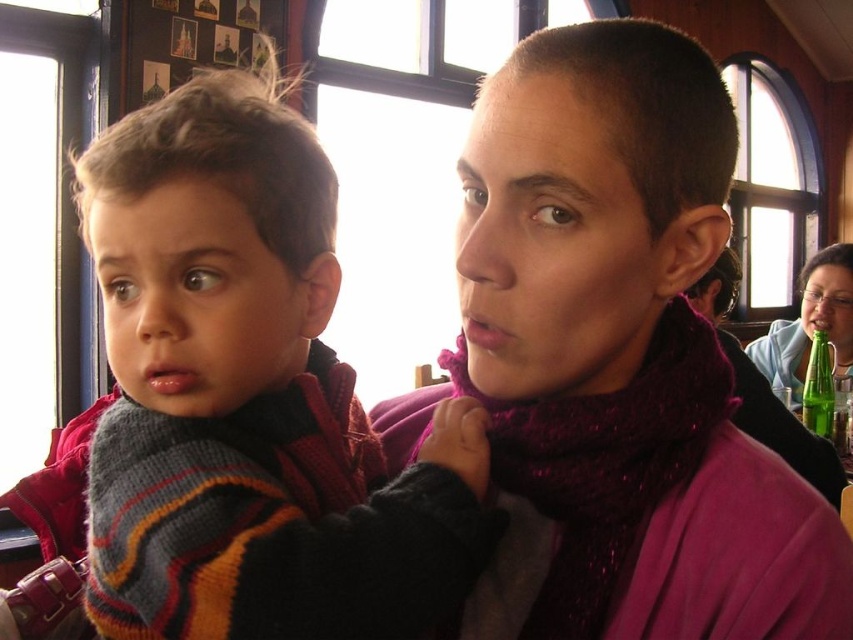
Question: Can you confirm if maroon knitted scarf at center is bigger than green glass bottle at upper right?

Choices:
 (A) no
 (B) yes

Answer: (A)

Question: Estimate the real-world distances between objects in this image. Which object is closer to the woolen maroon scarf at center?

Choices:
 (A) striped knit sweater at left
 (B) maroon knitted scarf at center

Answer: (B)

Question: Can you confirm if woolen maroon scarf at center is thinner than green glass bottle at upper right?

Choices:
 (A) no
 (B) yes

Answer: (B)

Question: Is woolen maroon scarf at center closer to camera compared to green glass bottle at upper right?

Choices:
 (A) yes
 (B) no

Answer: (A)

Question: Estimate the real-world distances between objects in this image. Which object is closer to the woolen maroon scarf at center?

Choices:
 (A) maroon knitted scarf at center
 (B) striped knit sweater at left
 (C) green glass bottle at upper right

Answer: (A)

Question: Which point appears closest to the camera in this image?

Choices:
 (A) (793, 618)
 (B) (387, 499)
 (C) (674, 305)

Answer: (A)